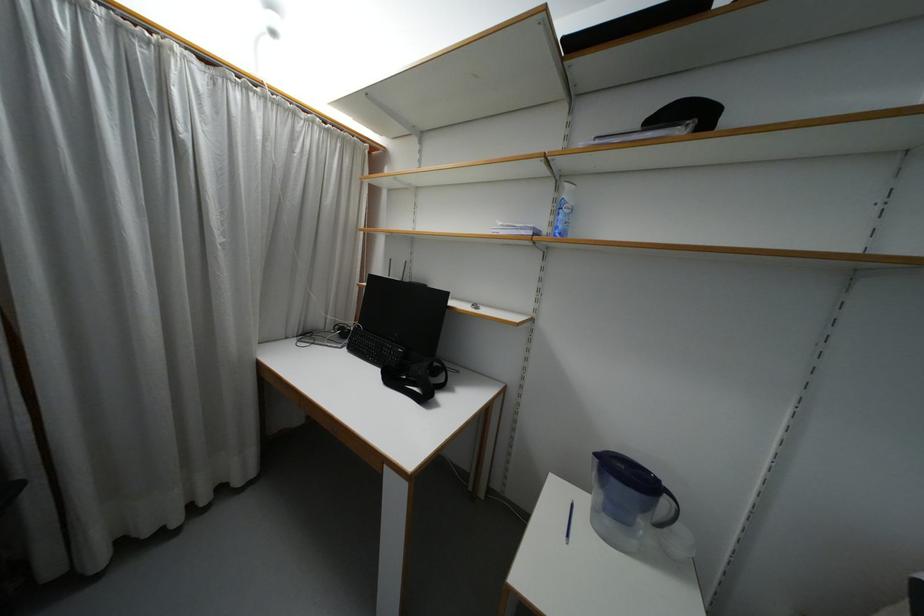
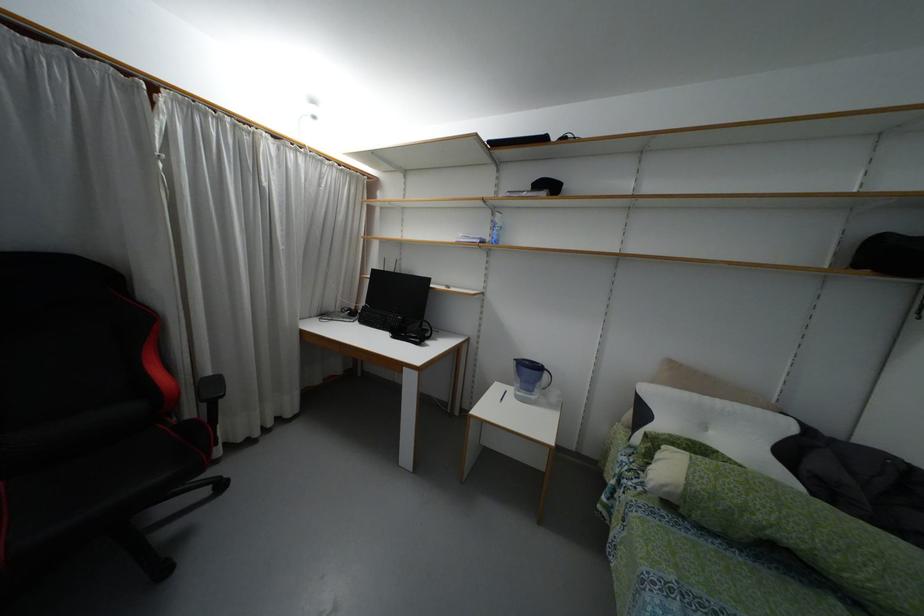
Locate, in the second image, the point that corresponds to (x=663, y=501) in the first image.

(544, 375)